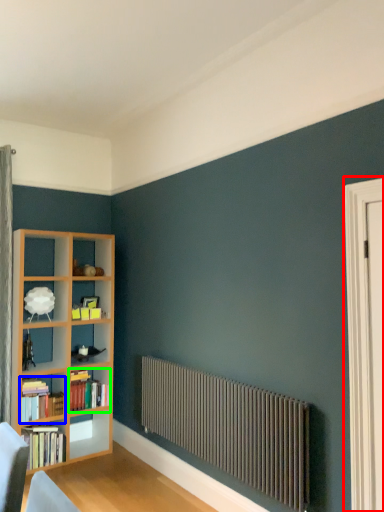
Question: Considering the real-world distances, which object is farthest from screen door (highlighted by a red box)? book (highlighted by a blue box) or book (highlighted by a green box)?

Choices:
 (A) book
 (B) book

Answer: (A)